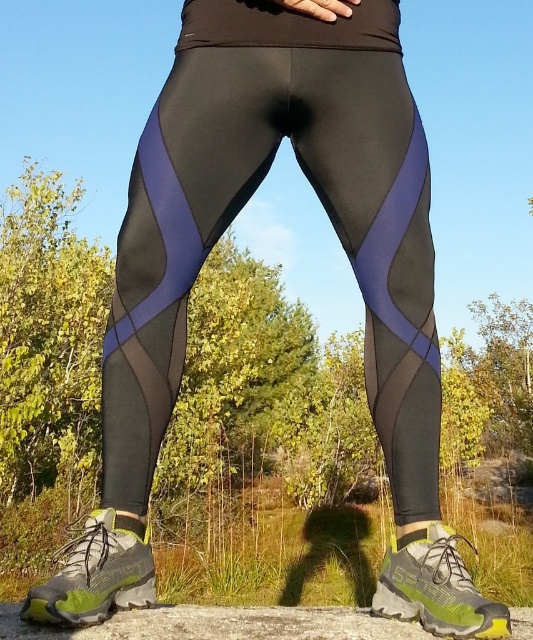
Could you measure the distance between green mesh running shoe at lower left and green mesh running shoe at lower right?

The distance of green mesh running shoe at lower left from green mesh running shoe at lower right is 49.62 centimeters.

What do you see at coordinates (96, 573) in the screenshot? I see `green mesh running shoe at lower left` at bounding box center [96, 573].

Find the location of a particular element. The image size is (533, 640). green mesh running shoe at lower left is located at coordinates (96, 573).

Does black mesh leggings at center come in front of green mesh running shoe at lower right?

No, it is behind green mesh running shoe at lower right.

Between black mesh leggings at center and green mesh running shoe at lower right, which one is positioned lower?

Positioned lower is green mesh running shoe at lower right.

Looking at this image, who is more forward, (160,390) or (464,577)?

Point (464,577)

I want to click on black mesh leggings at center, so click(x=239, y=209).

Identify the location of black mesh leggings at center. (239, 209).

Is black mesh leggings at center bigger than green mesh running shoe at lower left?

Yes, black mesh leggings at center is bigger than green mesh running shoe at lower left.

Find the location of a particular element. The height and width of the screenshot is (640, 533). black mesh leggings at center is located at coordinates (239, 209).